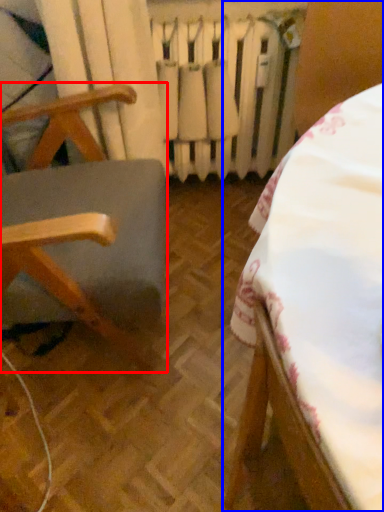
Question: Among these objects, which one is farthest to the camera, furniture (highlighted by a red box) or furniture (highlighted by a blue box)?

Choices:
 (A) furniture
 (B) furniture

Answer: (A)